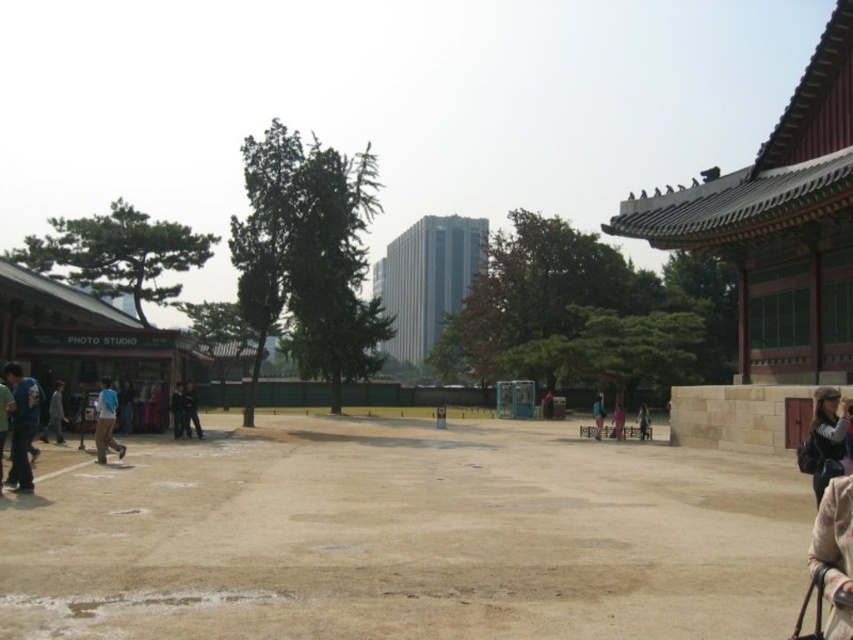
Question: Based on their relative distances, which object is nearer to the brown sandy ground at center?

Choices:
 (A) dark blue fabric at center
 (B) smooth glass skyscraper at center

Answer: (A)

Question: Does blue cotton shirt at lower left come in front of gray fabric jacket at lower left?

Choices:
 (A) no
 (B) yes

Answer: (B)

Question: Observing the image, what is the correct spatial positioning of smooth glass skyscraper at center in reference to dark blue fabric at center?

Choices:
 (A) above
 (B) below

Answer: (A)

Question: Where is blue denim jeans at center located in relation to pink fabric dress at lower right in the image?

Choices:
 (A) above
 (B) below

Answer: (B)

Question: Which object appears closest to the camera in this image?

Choices:
 (A) dark blue uniform at center
 (B) blue fabric jacket at lower left
 (C) gray fabric jacket at lower left
 (D) dark blue fabric at center

Answer: (B)

Question: Based on their relative distances, which object is nearer to the dark blue fabric at center?

Choices:
 (A) brown sandy ground at center
 (B) dark brown leather jacket at lower right
 (C) pink fabric dress at lower right

Answer: (A)